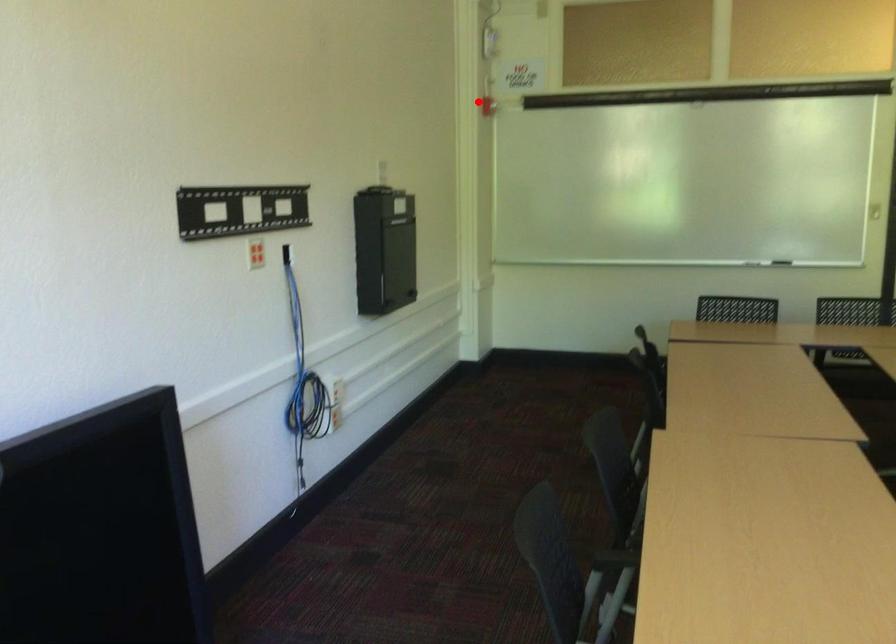
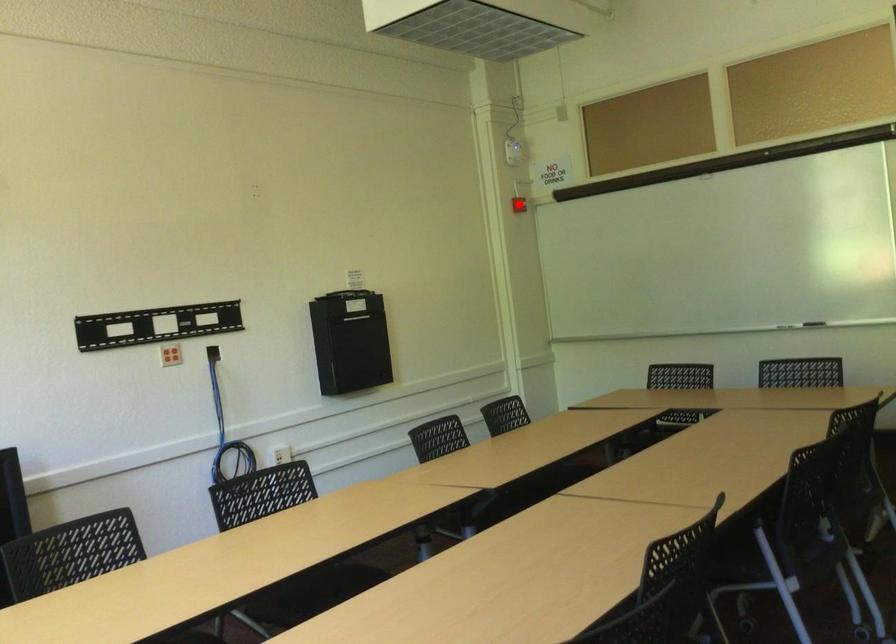
I am providing you with two images of the same scene from different viewpoints. A red point is marked on the first image and another point is marked on the second image. Do the highlighted points in image1 and image2 indicate the same real-world spot?

Yes